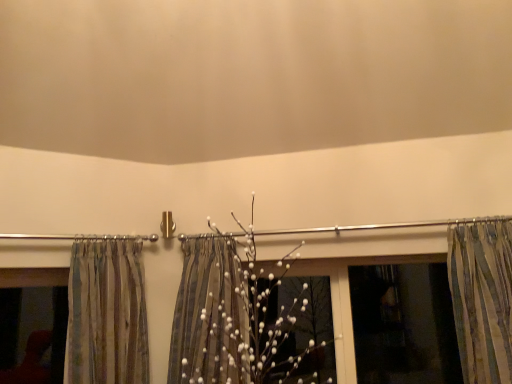
Question: Based on their positions, is striped fabric curtain at left, the 2th curtain from the right, located to the left or right of striped fabric shower curtain at center?

Choices:
 (A) left
 (B) right

Answer: (A)

Question: In the image, is striped fabric curtain at left, the 2th curtain from the right, positioned in front of or behind striped fabric shower curtain at center?

Choices:
 (A) behind
 (B) front

Answer: (B)

Question: Estimate the real-world distances between objects in this image. Which object is closer to the transparent plastic window screen at right?

Choices:
 (A) matte glass window at left
 (B) striped fabric shower curtain at center
 (C) striped fabric curtain at right, the 2th curtain in the left-to-right sequence
 (D) striped fabric curtain at left, marked as the 1th curtain in a left-to-right arrangement

Answer: (C)

Question: Based on their relative distances, which object is farther from the striped fabric curtain at right, which is the 1th curtain from right to left?

Choices:
 (A) matte glass window at left
 (B) striped fabric shower curtain at center
 (C) transparent plastic window screen at right
 (D) striped fabric curtain at left, the 2th curtain from the right

Answer: (A)